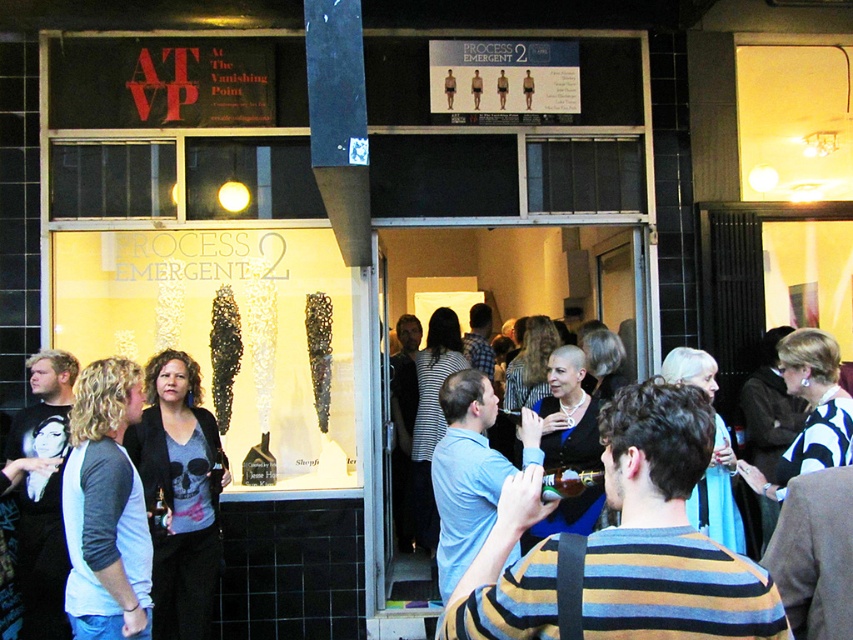
Question: Which point is farther to the camera?

Choices:
 (A) striped sweater at center
 (B) matte black jacket at center

Answer: (B)

Question: Among these points, which one is nearest to the camera?

Choices:
 (A) (634, 620)
 (B) (154, 616)
 (C) (105, 556)

Answer: (A)

Question: Does striped sweater at center have a greater width compared to matte black jacket at center?

Choices:
 (A) no
 (B) yes

Answer: (B)

Question: Considering the real-world distances, which object is farthest from the white cotton t-shirt at center-left?

Choices:
 (A) striped sweater at center
 (B) matte black jacket at center

Answer: (A)

Question: Is white cotton t-shirt at center-left smaller than matte black jacket at center?

Choices:
 (A) no
 (B) yes

Answer: (B)

Question: Does striped sweater at center lie in front of matte black jacket at center?

Choices:
 (A) yes
 (B) no

Answer: (A)